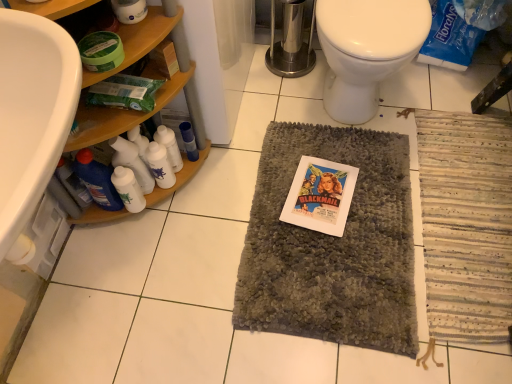
Describe the element at coordinates (117, 117) in the screenshot. The image size is (512, 384). I see `woodenshelves at left` at that location.

Locate an element on the screen. The height and width of the screenshot is (384, 512). green matte jar at upper left is located at coordinates (101, 51).

The image size is (512, 384). Find the location of `striped fabric bath mat at lower right`. striped fabric bath mat at lower right is located at coordinates (466, 224).

What do you see at coordinates (128, 189) in the screenshot? I see `white glossy bottle at lower left, the 4th bottle viewed from the right` at bounding box center [128, 189].

What do you see at coordinates (332, 245) in the screenshot? I see `gray shaggy mat at center` at bounding box center [332, 245].

What do you see at coordinates (97, 180) in the screenshot? I see `blue glossy bottle at lower left, which is the 5th bottle from right to left` at bounding box center [97, 180].

Identify the location of woodenshelves at left. This screenshot has height=384, width=512. (117, 117).

Is striped fabric bath mat at lower right facing towards white plastic bottles at left, placed as the fourth bottle when sorted from left to right?

No.

How different are the orientations of striped fabric bath mat at lower right and white plastic bottles at left, which is the 2th bottle in right-to-left order, in degrees?

The angular difference between striped fabric bath mat at lower right and white plastic bottles at left, which is the 2th bottle in right-to-left order, is 144 degrees.

From the image's perspective, is striped fabric bath mat at lower right under white plastic bottles at left, placed as the fourth bottle when sorted from left to right?

Yes.

Considering the relative positions of striped fabric bath mat at lower right and white plastic bottles at left, which is the 2th bottle in right-to-left order, in the image provided, is striped fabric bath mat at lower right to the right of white plastic bottles at left, which is the 2th bottle in right-to-left order, from the viewer's perspective?

Yes, striped fabric bath mat at lower right is to the right of white plastic bottles at left, which is the 2th bottle in right-to-left order.

Which object is positioned more to the left, white plastic bottles at left, placed as the fourth bottle when sorted from left to right, or blue glossy bottle at lower left, which is the 5th bottle from right to left?

Positioned to the left is blue glossy bottle at lower left, which is the 5th bottle from right to left.

From a real-world perspective, count 2nd bottles upward from the white plastic bottles at left, placed as the fourth bottle when sorted from left to right, and point to it. Please provide its 2D coordinates.

[(97, 180)]

Is point (168, 150) less distant than point (105, 196)?

No, (168, 150) is further to viewer.

Could you tell me if blue plastic bottle at center, the 1th bottle from the right, is turned towards matte paper comic book at center?

No.

Does blue plastic bottle at center, the 1th bottle from the right, have a lesser width compared to matte paper comic book at center?

Yes.

Consider the image. Choose the correct answer: Is blue plastic bottle at center, the 1th bottle from the right, inside matte paper comic book at center or outside it?

blue plastic bottle at center, the 1th bottle from the right, lies outside matte paper comic book at center.

From a real-world perspective, which is physically above, white glossy bottles at left, which is the 3th bottle from right to left, or blue plastic bottle at center, which is the 5th bottle from left to right?

From a 3D spatial view, white glossy bottles at left, which is the 3th bottle from right to left, is above.

Is white glossy bottles at left, the 3th bottle in the left-to-right sequence, in contact with blue plastic bottle at center, the 1th bottle from the right?

No, white glossy bottles at left, the 3th bottle in the left-to-right sequence, is not touching blue plastic bottle at center, the 1th bottle from the right.

Which is in front, point (168, 158) or point (193, 152)?

The point (168, 158) is in front.

From the image's perspective, between white glossy bottles at left, which is the 3th bottle from right to left, and blue plastic bottle at center, the 1th bottle from the right, who is located below?

white glossy bottles at left, which is the 3th bottle from right to left.

Would you say blue glossy bottle at lower left, which is the 5th bottle from right to left, is to the left or to the right of striped fabric bath mat at lower right in the picture?

From the image, it's evident that blue glossy bottle at lower left, which is the 5th bottle from right to left, is to the left of striped fabric bath mat at lower right.

Is point (85, 178) more distant than point (440, 121)?

No, it is in front of (440, 121).

Considering the sizes of blue glossy bottle at lower left, which appears as the 1th bottle when viewed from the left, and striped fabric bath mat at lower right in the image, is blue glossy bottle at lower left, which appears as the 1th bottle when viewed from the left, taller or shorter than striped fabric bath mat at lower right?

Clearly, blue glossy bottle at lower left, which appears as the 1th bottle when viewed from the left, is taller compared to striped fabric bath mat at lower right.

Is blue glossy bottle at lower left, which appears as the 1th bottle when viewed from the left, situated inside striped fabric bath mat at lower right or outside?

blue glossy bottle at lower left, which appears as the 1th bottle when viewed from the left, is spatially situated outside striped fabric bath mat at lower right.

Find the location of a particular element. Image resolution: width=512 pixels, height=384 pixels. bath mat that appears below the matte paper comic book at center (from the image's perspective) is located at coordinates (466, 224).

Does matte paper comic book at center turn towards striped fabric bath mat at lower right?

No, matte paper comic book at center is not oriented towards striped fabric bath mat at lower right.

From the picture: Is striped fabric bath mat at lower right inside matte paper comic book at center?

No, matte paper comic book at center does not contain striped fabric bath mat at lower right.

Is matte paper comic book at center to the left of striped fabric bath mat at lower right from the viewer's perspective?

Yes, matte paper comic book at center is to the left of striped fabric bath mat at lower right.

Is striped fabric bath mat at lower right facing away from green matte jar at upper left?

No, striped fabric bath mat at lower right's orientation is not away from green matte jar at upper left.

From a real-world perspective, does striped fabric bath mat at lower right stand above green matte jar at upper left?

Incorrect, from a real-world perspective, striped fabric bath mat at lower right is lower than green matte jar at upper left.

From the image's perspective, which is above, striped fabric bath mat at lower right or green matte jar at upper left?

green matte jar at upper left.

Where is `bath mat below the white plastic bottles at left, placed as the fourth bottle when sorted from left to right (from the image's perspective)`? The height and width of the screenshot is (384, 512). bath mat below the white plastic bottles at left, placed as the fourth bottle when sorted from left to right (from the image's perspective) is located at coordinates (466, 224).

Identify the location of the 3rd bottle in front of the white plastic bottles at left, placed as the fourth bottle when sorted from left to right, counting from the anchor's position. (97, 180).

Estimate the real-world distances between objects in this image. Which object is closer to blue glossy bottle at lower left, which appears as the 1th bottle when viewed from the left, white glossy bottle at lower left, the second bottle in the left-to-right sequence, or matte paper comic book at center?

Based on the image, white glossy bottle at lower left, the second bottle in the left-to-right sequence, appears to be nearer to blue glossy bottle at lower left, which appears as the 1th bottle when viewed from the left.

Based on their spatial positions, is blue plastic bottle at center, which is the 5th bottle from left to right, or matte paper comic book at center closer to striped fabric bath mat at lower right?

matte paper comic book at center lies closer to striped fabric bath mat at lower right than the other object.

Based on their spatial positions, is woodenshelves at left or white glossy bottles at left, which is the 3th bottle from right to left, further from woodenshelves at left?

white glossy bottles at left, which is the 3th bottle from right to left, lies further to woodenshelves at left than the other object.

Looking at the image, which one is located further to green matte jar at upper left, gray shaggy mat at center or matte paper comic book at center?

Based on the image, gray shaggy mat at center appears to be further to green matte jar at upper left.

From the image, which object appears to be farther from blue plastic bottle at center, which is the 5th bottle from left to right, green matte jar at upper left or white glossy bottles at left, the 3th bottle in the left-to-right sequence?

Based on the image, green matte jar at upper left appears to be further to blue plastic bottle at center, which is the 5th bottle from left to right.

Considering their positions, is blue plastic bottle at center, the 1th bottle from the right, positioned further to matte paper comic book at center than woodenshelves at left?

Based on the image, woodenshelves at left appears to be further to matte paper comic book at center.

When comparing their distances from white plastic bottles at left, placed as the fourth bottle when sorted from left to right, does woodenshelves at left or green matte jar at upper left seem closer?

woodenshelves at left lies closer to white plastic bottles at left, placed as the fourth bottle when sorted from left to right, than the other object.

Looking at the image, which one is located further to striped fabric bath mat at lower right, white plastic bottles at left, placed as the fourth bottle when sorted from left to right, or blue glossy bottle at lower left, which appears as the 1th bottle when viewed from the left?

blue glossy bottle at lower left, which appears as the 1th bottle when viewed from the left, is positioned further to the anchor striped fabric bath mat at lower right.

The height and width of the screenshot is (384, 512). I want to click on shelf between white glossy bottle at lower left, the second bottle in the left-to-right sequence, and striped fabric bath mat at lower right, in the horizontal direction, so click(117, 117).

Identify the location of bottle between white plastic bottles at left, which is the 2th bottle in right-to-left order, and striped fabric bath mat at lower right, in the horizontal direction. This screenshot has height=384, width=512. (189, 141).

Where is `comic book between white plastic bottles at left, placed as the fourth bottle when sorted from left to right, and striped fabric bath mat at lower right from left to right`? comic book between white plastic bottles at left, placed as the fourth bottle when sorted from left to right, and striped fabric bath mat at lower right from left to right is located at coordinates (320, 196).

You are a GUI agent. You are given a task and a screenshot of the screen. Output one action in this format:
    pyautogui.click(x=<x>, y=<y>)
    Task: Click on the bathroom cabinet between woodenshelves at left and gray shaggy mat at center vertically
    The width and height of the screenshot is (512, 384).
    Given the screenshot: What is the action you would take?
    pyautogui.click(x=157, y=93)